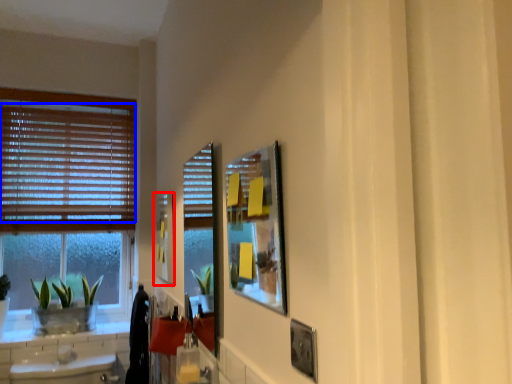
Question: Among these objects, which one is nearest to the camera, picture frame (highlighted by a red box) or blind (highlighted by a blue box)?

Choices:
 (A) picture frame
 (B) blind

Answer: (A)